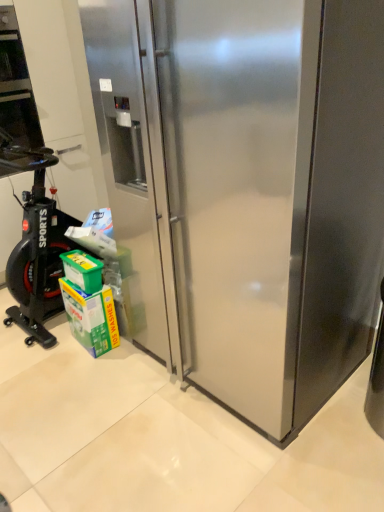
Question: Is green plastic box at lower left positioned behind green cardboard carton at lower left?

Choices:
 (A) no
 (B) yes

Answer: (A)

Question: Can you confirm if green plastic box at lower left is smaller than green cardboard carton at lower left?

Choices:
 (A) yes
 (B) no

Answer: (A)

Question: Is green plastic box at lower left far away from green cardboard carton at lower left?

Choices:
 (A) no
 (B) yes

Answer: (A)

Question: Can you confirm if green plastic box at lower left is bigger than green cardboard carton at lower left?

Choices:
 (A) no
 (B) yes

Answer: (A)

Question: Is green plastic box at lower left facing towards green cardboard carton at lower left?

Choices:
 (A) yes
 (B) no

Answer: (B)

Question: Is green plastic box at lower left wider or thinner than green cardboard carton at lower left?

Choices:
 (A) thin
 (B) wide

Answer: (B)

Question: Considering the positions of green plastic box at lower left and green cardboard carton at lower left in the image, is green plastic box at lower left taller or shorter than green cardboard carton at lower left?

Choices:
 (A) tall
 (B) short

Answer: (B)

Question: Which is correct: green plastic box at lower left is inside green cardboard carton at lower left, or outside of it?

Choices:
 (A) outside
 (B) inside

Answer: (A)

Question: From a real-world perspective, is green plastic box at lower left physically located above or below green cardboard carton at lower left?

Choices:
 (A) below
 (B) above

Answer: (B)

Question: In terms of size, does stainless steel refrigerator at center appear bigger or smaller than green cardboard carton at lower left?

Choices:
 (A) big
 (B) small

Answer: (A)

Question: Visually, is stainless steel refrigerator at center positioned to the left or to the right of green cardboard carton at lower left?

Choices:
 (A) right
 (B) left

Answer: (A)

Question: Relative to green cardboard carton at lower left, is stainless steel refrigerator at center in front or behind?

Choices:
 (A) behind
 (B) front

Answer: (B)

Question: Which is correct: stainless steel refrigerator at center is inside green cardboard carton at lower left, or outside of it?

Choices:
 (A) inside
 (B) outside

Answer: (B)

Question: Is green cardboard carton at lower left spatially inside green plastic box at lower left, or outside of it?

Choices:
 (A) inside
 (B) outside

Answer: (B)

Question: Would you say green cardboard carton at lower left is to the left or to the right of green plastic box at lower left in the picture?

Choices:
 (A) left
 (B) right

Answer: (B)